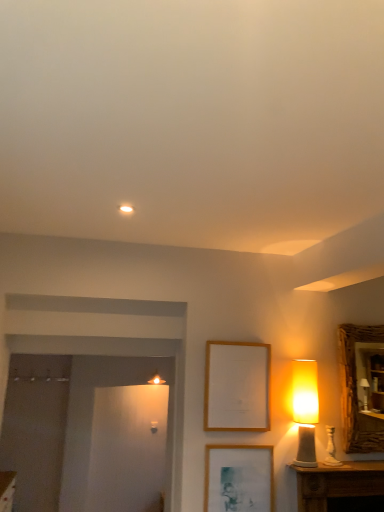
Question: Is wooden textured mirror at right surrounded by matte yellow lampshade at right?

Choices:
 (A) yes
 (B) no

Answer: (B)

Question: Is matte yellow lampshade at right behind wooden textured mirror at right?

Choices:
 (A) yes
 (B) no

Answer: (B)

Question: Is matte yellow lampshade at right to the right of wooden textured mirror at right from the viewer's perspective?

Choices:
 (A) yes
 (B) no

Answer: (B)

Question: Is matte yellow lampshade at right positioned with its back to wooden textured mirror at right?

Choices:
 (A) no
 (B) yes

Answer: (A)

Question: Does matte yellow lampshade at right have a lesser width compared to wooden textured mirror at right?

Choices:
 (A) yes
 (B) no

Answer: (B)

Question: From their relative heights in the image, would you say matte yellow lampshade at right is taller or shorter than wooden picture frame at lower center, arranged as the second picture frame when viewed from the top?

Choices:
 (A) tall
 (B) short

Answer: (A)

Question: Looking at the image, does matte yellow lampshade at right seem bigger or smaller compared to wooden picture frame at lower center, the 1th picture frame ordered from the bottom?

Choices:
 (A) small
 (B) big

Answer: (B)

Question: Relative to wooden picture frame at lower center, the 1th picture frame ordered from the bottom, is matte yellow lampshade at right in front or behind?

Choices:
 (A) front
 (B) behind

Answer: (B)

Question: From the image's perspective, is matte yellow lampshade at right located above or below wooden picture frame at lower center, the 1th picture frame ordered from the bottom?

Choices:
 (A) below
 (B) above

Answer: (B)

Question: Does point (301, 367) appear closer or farther from the camera than point (349, 401)?

Choices:
 (A) farther
 (B) closer

Answer: (B)

Question: From their relative heights in the image, would you say matte yellow lampshade at right is taller or shorter than wooden textured mirror at right?

Choices:
 (A) short
 (B) tall

Answer: (A)

Question: In the image, is matte yellow lampshade at right on the left side or the right side of wooden textured mirror at right?

Choices:
 (A) left
 (B) right

Answer: (A)

Question: From a real-world perspective, is matte yellow lampshade at right physically located above or below wooden textured mirror at right?

Choices:
 (A) above
 (B) below

Answer: (B)

Question: From a real-world perspective, is wooden picture frame at center, which appears as the second picture frame when ordered from the bottom, above or below wooden textured mirror at right?

Choices:
 (A) below
 (B) above

Answer: (A)

Question: In terms of size, does wooden picture frame at center, which is counted as the 1th picture frame, starting from the top, appear bigger or smaller than wooden textured mirror at right?

Choices:
 (A) big
 (B) small

Answer: (B)